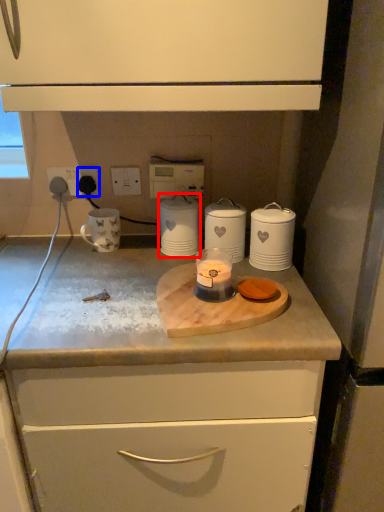
Question: Which object is further to the camera taking this photo, home appliance (highlighted by a red box) or electric outlet (highlighted by a blue box)?

Choices:
 (A) home appliance
 (B) electric outlet

Answer: (B)